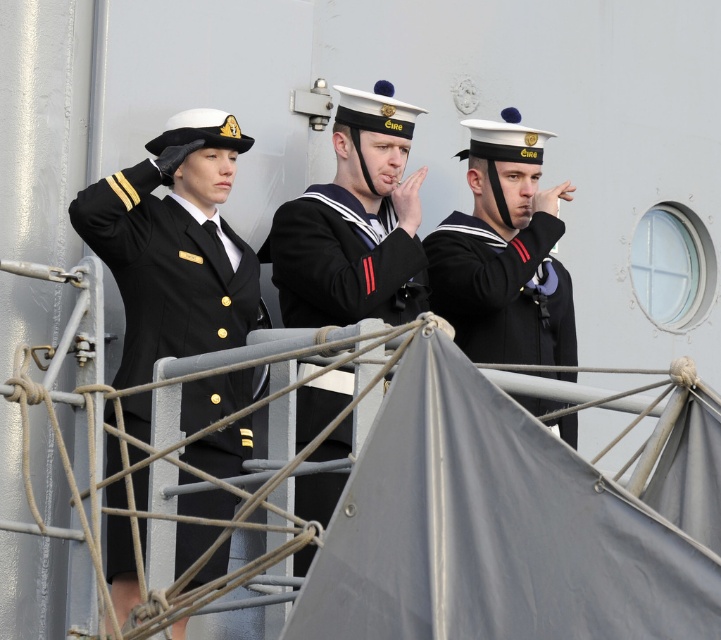
Question: Is the position of black woolen sweater at center more distant than that of sailor uniform at center?

Choices:
 (A) yes
 (B) no

Answer: (B)

Question: Which point is farther to the camera?

Choices:
 (A) sailor uniform at center
 (B) black woolen sweater at center

Answer: (A)

Question: Among these points, which one is farthest from the camera?

Choices:
 (A) (225, 552)
 (B) (567, 273)

Answer: (B)

Question: Where is black matte uniform at left located in relation to sailor uniform at center in the image?

Choices:
 (A) above
 (B) below

Answer: (B)

Question: Estimate the real-world distances between objects in this image. Which object is closer to the sailor uniform at center?

Choices:
 (A) black woolen sweater at center
 (B) black matte uniform at left

Answer: (A)

Question: Is black matte uniform at left thinner than black woolen sweater at center?

Choices:
 (A) yes
 (B) no

Answer: (A)